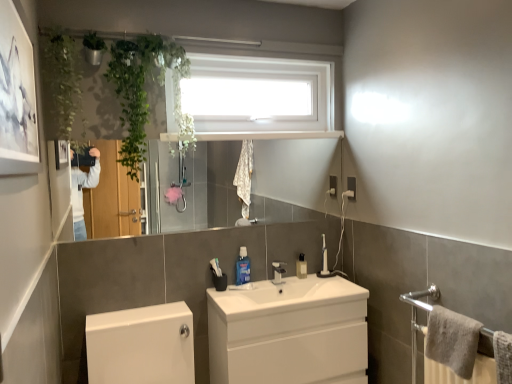
Question: Relative to white glossy sink at center, is metallic silver mirror at upper center in front or behind?

Choices:
 (A) behind
 (B) front

Answer: (B)

Question: Is metallic silver mirror at upper center bigger or smaller than white glossy sink at center?

Choices:
 (A) small
 (B) big

Answer: (B)

Question: Which object is the farthest from the white glossy sink at center?

Choices:
 (A) white plastic window at upper center
 (B) white glossy toilet at lower left
 (C) green leafy plant at upper left
 (D) gray cotton towel at right
 (E) metallic silver mirror at upper center

Answer: (E)

Question: Which object is the closest to the green leafy plant at upper left?

Choices:
 (A) metallic silver mirror at upper center
 (B) white plastic window at upper center
 (C) gray cotton towel at right
 (D) translucent plastic bottle at center, which is the second toiletry from front to back
 (E) white glossy toilet at lower left

Answer: (B)